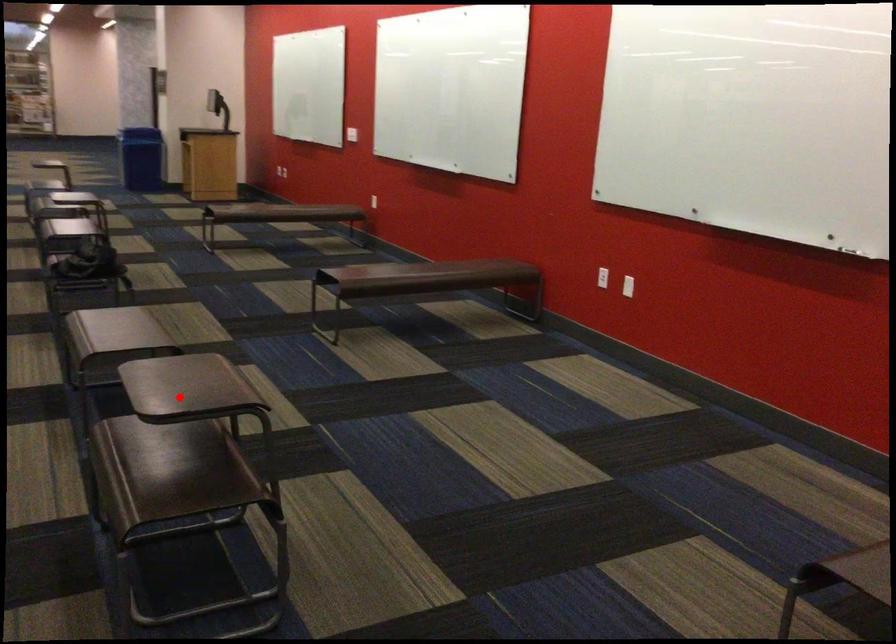
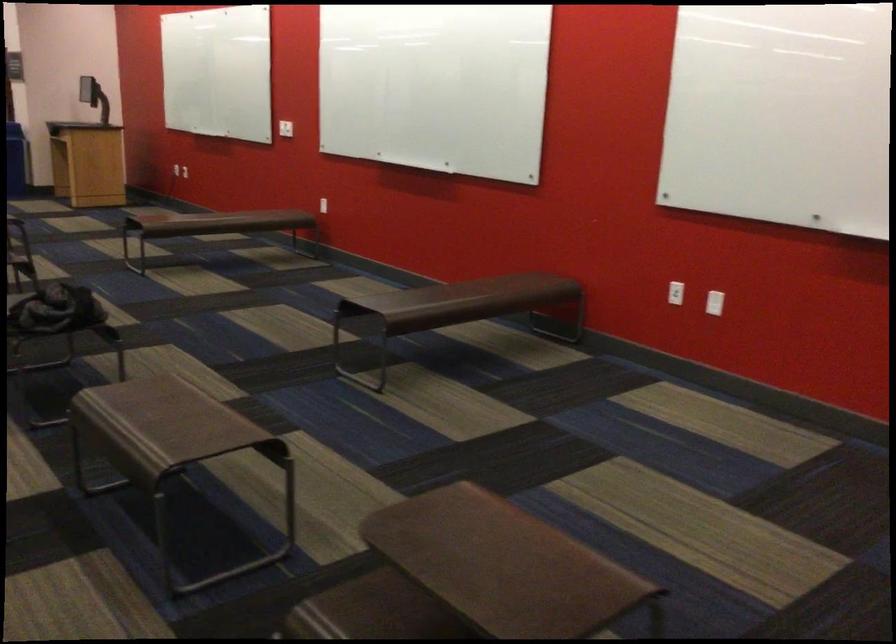
Where in the second image is the point corresponding to the highlighted location from the first image?

(498, 564)